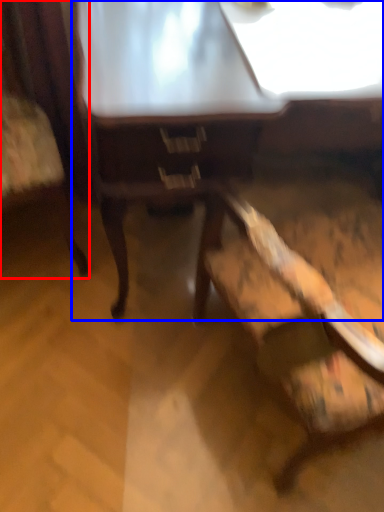
Question: Which object is closer to the camera taking this photo, chair (highlighted by a red box) or table (highlighted by a blue box)?

Choices:
 (A) chair
 (B) table

Answer: (A)